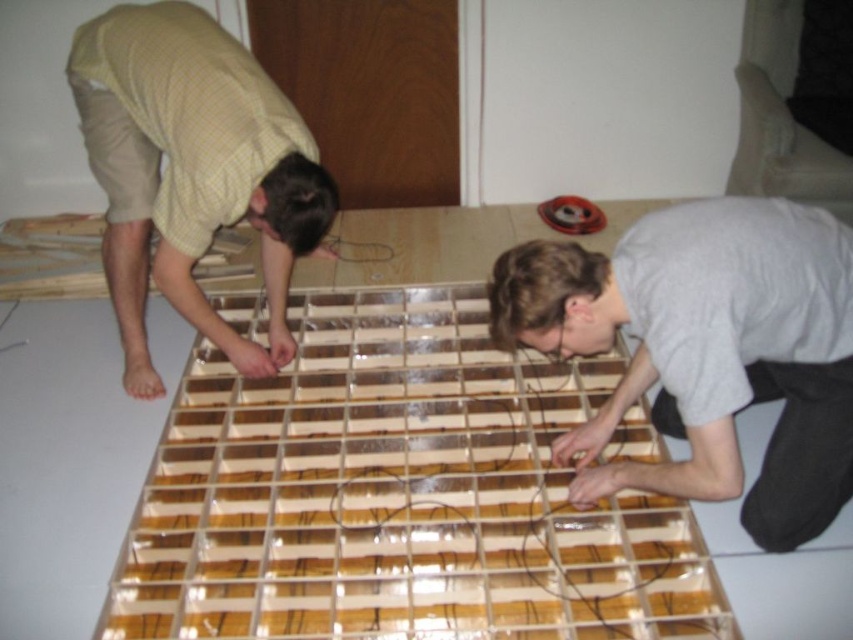
Which of these two, gray matte shirt at lower right or matte yellow shirt at left, stands shorter?

With less height is gray matte shirt at lower right.

In the scene shown: Can you confirm if gray matte shirt at lower right is taller than matte yellow shirt at left?

No.

Who is more forward, (804,369) or (97,36)?

Positioned in front is point (804,369).

The image size is (853, 640). Find the location of `gray matte shirt at lower right`. gray matte shirt at lower right is located at coordinates (706, 349).